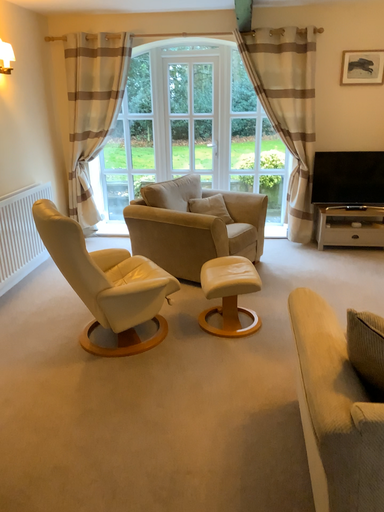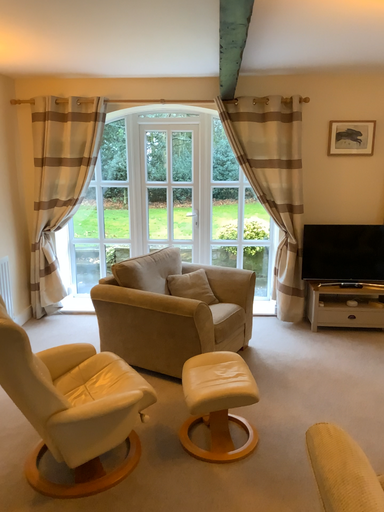
Question: How did the camera likely rotate when shooting the video?

Choices:
 (A) rotated downward
 (B) rotated upward

Answer: (B)